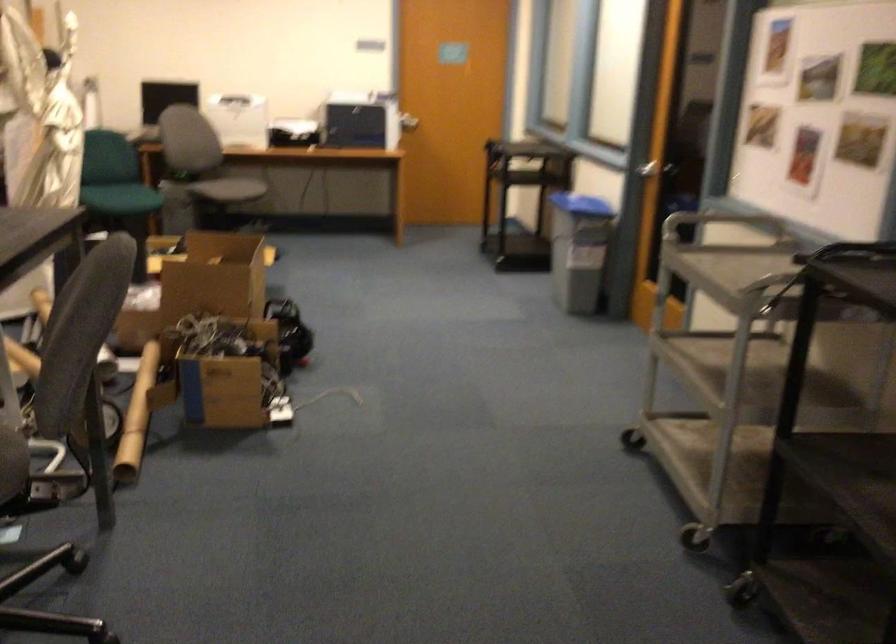
Describe the element at coordinates (582, 205) in the screenshot. The image size is (896, 644). I see `a blue trash can lid` at that location.